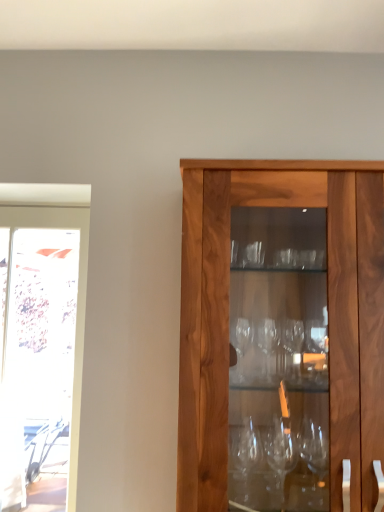
At what (x,y) coordinates should I click in order to perform the action: click on transparent glass screen door at left. Please return your answer as a coordinate pair (x, y). The width and height of the screenshot is (384, 512). Looking at the image, I should click on (77, 298).

Describe the element at coordinates (77, 298) in the screenshot. This screenshot has height=512, width=384. I see `transparent glass screen door at left` at that location.

This screenshot has height=512, width=384. In order to click on walnut wood cabinet at center in this screenshot , I will do `click(221, 300)`.

Describe the element at coordinates (221, 300) in the screenshot. I see `walnut wood cabinet at center` at that location.

You are a GUI agent. You are given a task and a screenshot of the screen. Output one action in this format:
    pyautogui.click(x=<x>, y=<y>)
    Task: Click on the transparent glass screen door at left
    This screenshot has width=384, height=512.
    Given the screenshot: What is the action you would take?
    pyautogui.click(x=77, y=298)

Between transparent glass screen door at left and walnut wood cabinet at center, which one appears on the left side from the viewer's perspective?

From the viewer's perspective, transparent glass screen door at left appears more on the left side.

Based on the photo, between transparent glass screen door at left and walnut wood cabinet at center, which one is positioned in front?

walnut wood cabinet at center is in front.

Is point (72, 426) positioned after point (198, 315)?

Yes, point (72, 426) is behind point (198, 315).

From the image's perspective, which one is positioned lower, transparent glass screen door at left or walnut wood cabinet at center?

From the image's view, transparent glass screen door at left is below.

Consider the image. From a real-world perspective, is transparent glass screen door at left physically located above or below walnut wood cabinet at center?

transparent glass screen door at left is below walnut wood cabinet at center.

Is transparent glass screen door at left thinner than walnut wood cabinet at center?

Yes, transparent glass screen door at left is thinner than walnut wood cabinet at center.

Can you confirm if transparent glass screen door at left is shorter than walnut wood cabinet at center?

No, transparent glass screen door at left is not shorter than walnut wood cabinet at center.

Between transparent glass screen door at left and walnut wood cabinet at center, which one has larger size?

walnut wood cabinet at center.

From the picture: Do you think transparent glass screen door at left is within walnut wood cabinet at center, or outside of it?

transparent glass screen door at left is not inside walnut wood cabinet at center, it's outside.

Is transparent glass screen door at left next to walnut wood cabinet at center and touching it?

No.

Is walnut wood cabinet at center at the back of transparent glass screen door at left?

No, transparent glass screen door at left's orientation is not away from walnut wood cabinet at center.

How different are the orientations of transparent glass screen door at left and walnut wood cabinet at center in degrees?

The angular difference between transparent glass screen door at left and walnut wood cabinet at center is 0.192 degrees.

You are a GUI agent. You are given a task and a screenshot of the screen. Output one action in this format:
    pyautogui.click(x=<x>, y=<y>)
    Task: Click on the screen door below the walnut wood cabinet at center (from the image's perspective)
    This screenshot has width=384, height=512.
    Given the screenshot: What is the action you would take?
    pyautogui.click(x=77, y=298)

Between walnut wood cabinet at center and transparent glass screen door at left, which one appears on the left side from the viewer's perspective?

transparent glass screen door at left.

Is the depth of walnut wood cabinet at center greater than that of transparent glass screen door at left?

That is False.

Considering the points (196, 426) and (43, 222), which point is behind, point (196, 426) or point (43, 222)?

The point (43, 222) is farther.

From the image's perspective, which one is positioned higher, walnut wood cabinet at center or transparent glass screen door at left?

walnut wood cabinet at center.

From a real-world perspective, is walnut wood cabinet at center physically below transparent glass screen door at left?

No, from a real-world perspective, walnut wood cabinet at center is not under transparent glass screen door at left.

In terms of width, does walnut wood cabinet at center look wider or thinner when compared to transparent glass screen door at left?

walnut wood cabinet at center is wider than transparent glass screen door at left.

Does walnut wood cabinet at center have a greater height compared to transparent glass screen door at left?

In fact, walnut wood cabinet at center may be shorter than transparent glass screen door at left.

Considering the relative sizes of walnut wood cabinet at center and transparent glass screen door at left in the image provided, is walnut wood cabinet at center smaller than transparent glass screen door at left?

No, walnut wood cabinet at center is not smaller than transparent glass screen door at left.

Is walnut wood cabinet at center not inside transparent glass screen door at left?

Yes, walnut wood cabinet at center is located beyond the bounds of transparent glass screen door at left.

Is there a large distance between walnut wood cabinet at center and transparent glass screen door at left?

No, walnut wood cabinet at center is not far from transparent glass screen door at left.

Could you tell me if walnut wood cabinet at center is turned towards transparent glass screen door at left?

No, walnut wood cabinet at center is not aimed at transparent glass screen door at left.

Can you tell me how much walnut wood cabinet at center and transparent glass screen door at left differ in facing direction?

0.192 degrees.

Measure the distance from walnut wood cabinet at center to transparent glass screen door at left.

80.21 centimeters.

Where is `cabinetry above the transparent glass screen door at left (from the image's perspective)`? This screenshot has width=384, height=512. cabinetry above the transparent glass screen door at left (from the image's perspective) is located at coordinates (221, 300).

Find the location of `cabinetry in front of the transparent glass screen door at left`. cabinetry in front of the transparent glass screen door at left is located at coordinates (221, 300).

Identify the location of cabinetry above the transparent glass screen door at left (from a real-world perspective). This screenshot has width=384, height=512. (221, 300).